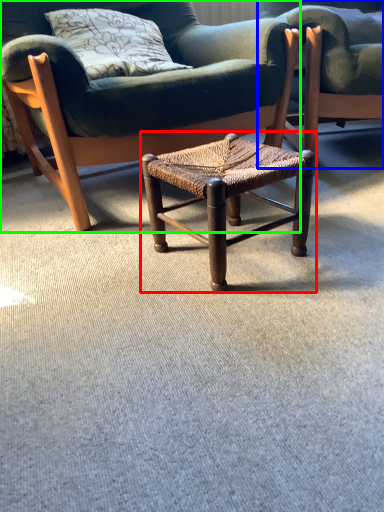
Question: Based on their relative distances, which object is farther from stool (highlighted by a red box)? Choose from chair (highlighted by a blue box) and chair (highlighted by a green box).

Choices:
 (A) chair
 (B) chair

Answer: (A)